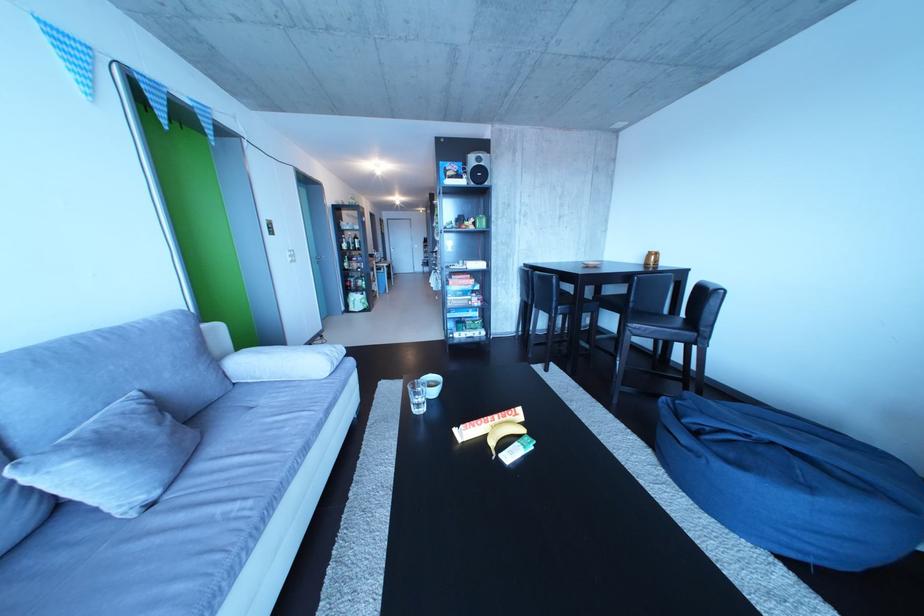
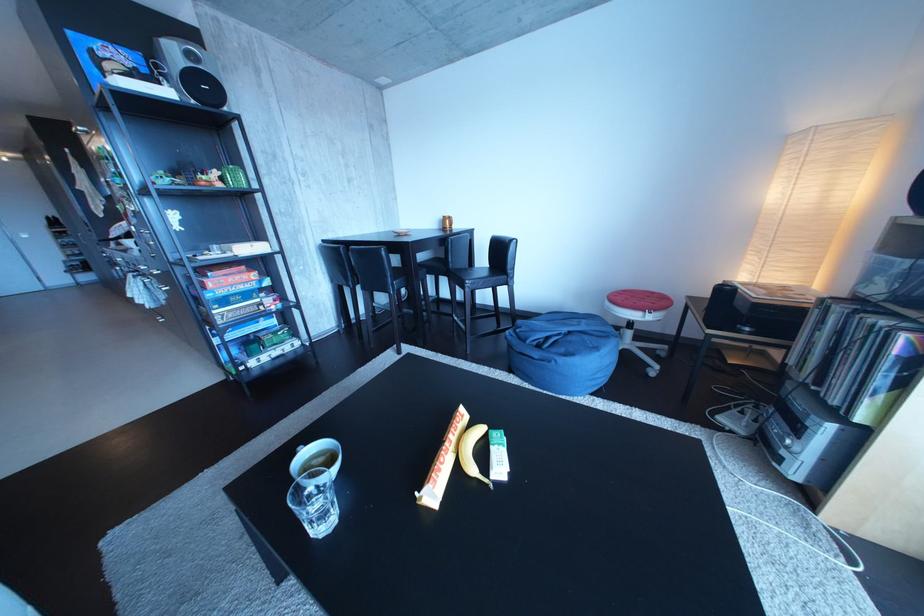
Locate, in the second image, the point that corresponds to (784,448) in the first image.

(582, 339)